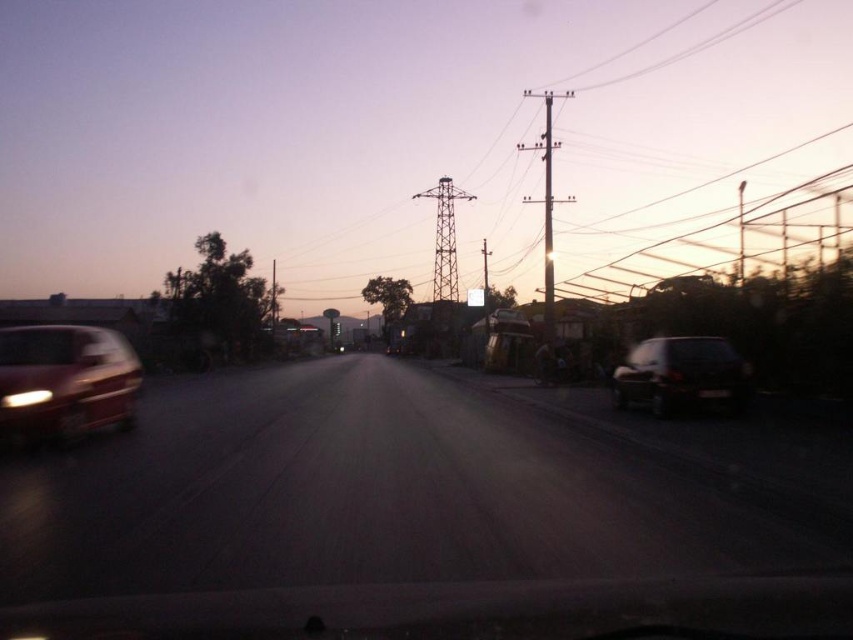
You are a pedestrian standing at the center of the road and see the shiny red car at left. Based on its position, in which direction should you move to avoid it?

The shiny red car at left is located at point (64,381), which is to the left and slightly forward of your position. To avoid it, move to the right side of the road.

You are a pedestrian standing at the point with coordinates point [35,349] and want to walk to the point with coordinates point [660,342]. Given the scene described, is there any obstacle between these two points that you should be aware of?

The point [35,349] is in front of point [660,342], so there is no obstacle between them. You can walk directly to the destination.